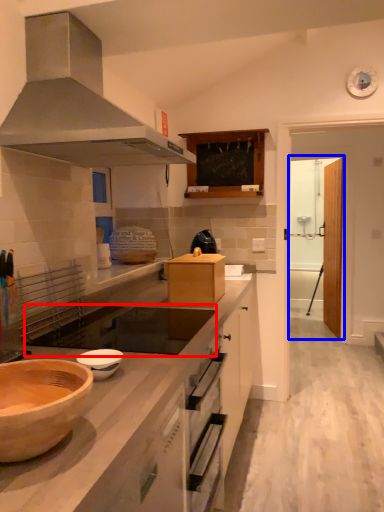
Question: Which of the following is the closest to the observer, gas stove (highlighted by a red box) or glass door (highlighted by a blue box)?

Choices:
 (A) gas stove
 (B) glass door

Answer: (A)